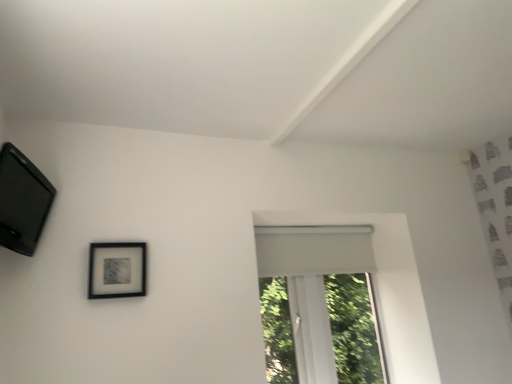
Question: From the image's perspective, is black matte picture frame at upper left, positioned as the second picture frame in bottom-to-top order, on top of white matte window at center?

Choices:
 (A) no
 (B) yes

Answer: (B)

Question: Would you consider black matte picture frame at upper left, the second picture frame in the back-to-front sequence, to be distant from white matte window at center?

Choices:
 (A) no
 (B) yes

Answer: (B)

Question: Can you confirm if black matte picture frame at upper left, the 1th picture frame positioned from the left, is shorter than white matte window at center?

Choices:
 (A) yes
 (B) no

Answer: (A)

Question: Is black matte picture frame at upper left, the 1th picture frame positioned from the left, wider than white matte window at center?

Choices:
 (A) yes
 (B) no

Answer: (A)

Question: Is black matte picture frame at upper left, the 1th picture frame positioned from the left, not within white matte window at center?

Choices:
 (A) yes
 (B) no

Answer: (A)

Question: In terms of height, does white matte window at center look taller or shorter compared to black matte picture frame at upper left, positioned as the second picture frame in bottom-to-top order?

Choices:
 (A) tall
 (B) short

Answer: (A)

Question: Looking at the image, does white matte window at center seem bigger or smaller compared to black matte picture frame at upper left, arranged as the 1th picture frame when viewed from the top?

Choices:
 (A) small
 (B) big

Answer: (B)

Question: Is white matte window at center spatially inside black matte picture frame at upper left, the 1th picture frame positioned from the left, or outside of it?

Choices:
 (A) inside
 (B) outside

Answer: (B)

Question: Is white matte window at center in front of or behind black matte picture frame at upper left, the 1th picture frame positioned from the left, in the image?

Choices:
 (A) front
 (B) behind

Answer: (B)

Question: Looking at their shapes, would you say black matte picture frame at upper left, the second picture frame in the back-to-front sequence, is wider or thinner than matte black picture frame at upper left, positioned as the second picture frame in top-to-bottom order?

Choices:
 (A) wide
 (B) thin

Answer: (A)

Question: Looking at the image, does black matte picture frame at upper left, the second picture frame in the back-to-front sequence, seem bigger or smaller compared to matte black picture frame at upper left, the 1th picture frame ordered from the bottom?

Choices:
 (A) big
 (B) small

Answer: (A)

Question: From the image's perspective, is black matte picture frame at upper left, the 1th picture frame positioned from the left, located above or below matte black picture frame at upper left, the 1th picture frame ordered from the bottom?

Choices:
 (A) below
 (B) above

Answer: (B)

Question: Considering the relative positions of black matte picture frame at upper left, the 1th picture frame viewed from the front, and matte black picture frame at upper left, the first picture frame from the right, in the image provided, is black matte picture frame at upper left, the 1th picture frame viewed from the front, to the left or to the right of matte black picture frame at upper left, the first picture frame from the right,?

Choices:
 (A) right
 (B) left

Answer: (B)

Question: Is point (298, 324) positioned closer to the camera than point (92, 256)?

Choices:
 (A) farther
 (B) closer

Answer: (A)

Question: Would you say white matte window at center is to the left or to the right of matte black picture frame at upper left, the first picture frame from the back, in the picture?

Choices:
 (A) right
 (B) left

Answer: (A)